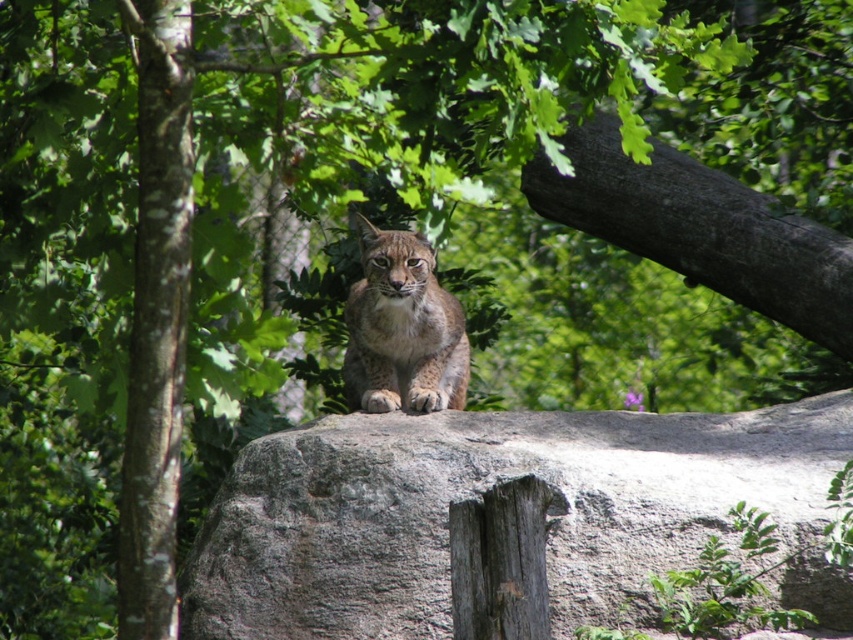
You are a wildlife photographer trying to capture a photo of the spotted fur cat at center. The gray rough boulder at center is blocking part of your view. Can you estimate if the boulder is large enough to fully obscure the cat if positioned directly in front of it?

The gray rough boulder at center is bigger than the spotted fur cat at center, so yes, the boulder could potentially fully obscure the cat if positioned directly in front of it due to its larger size.

Consider the image. A photographer wants to capture the gray rough boulder at center in the exact same position as in the original image. What 2D coordinates should they aim for to ensure the boulder is centered in their photo?

The photographer should aim for the 2D coordinates point at (477, 496) to ensure the gray rough boulder at center is centered in their photo.

You are a hiker who wants to take a photo of the bobcat. You are standing at point (186,19). The bobcat is at point (728,452). Which point is closer to you?

Point (186,19) is closer to you because you are standing there.